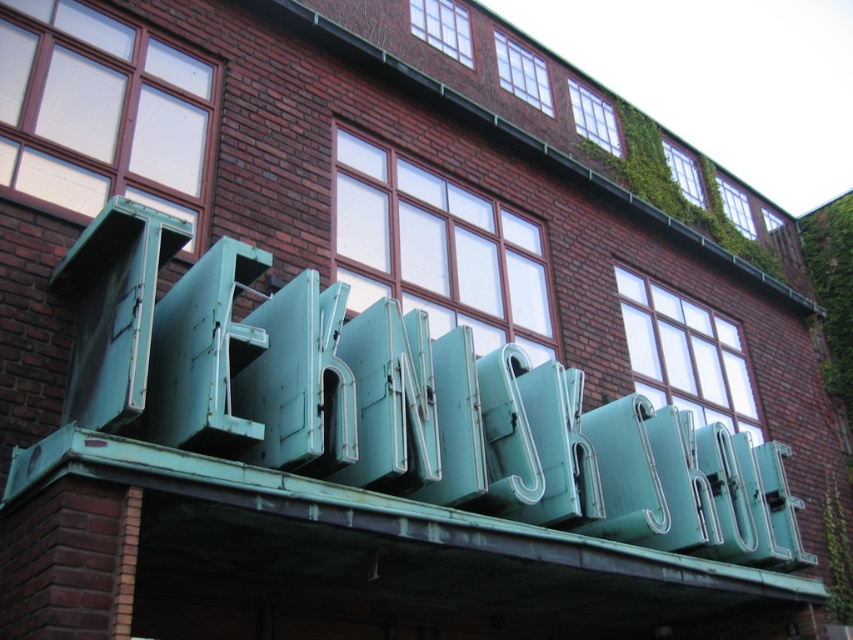
Question: Can you confirm if green patina sign at center is positioned to the right of green matte neon sign at center?

Choices:
 (A) no
 (B) yes

Answer: (A)

Question: Which point appears farthest from the camera in this image?

Choices:
 (A) (331, 365)
 (B) (405, 307)

Answer: (B)

Question: Among these objects, which one is nearest to the camera?

Choices:
 (A) green matte neon sign at center
 (B) green patina sign at center

Answer: (B)

Question: Observing the image, what is the correct spatial positioning of green patina sign at center in reference to green matte neon sign at center?

Choices:
 (A) left
 (B) right

Answer: (A)

Question: Is green patina sign at center smaller than green matte neon sign at center?

Choices:
 (A) yes
 (B) no

Answer: (A)